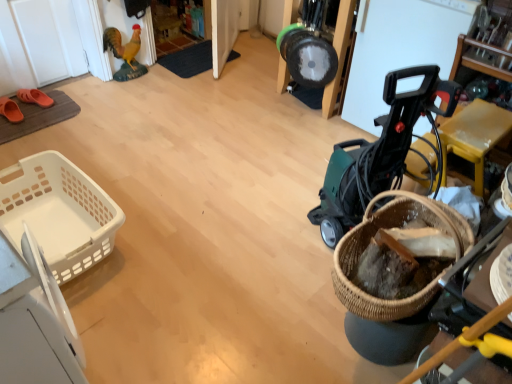
Image resolution: width=512 pixels, height=384 pixels. What are the coordinates of `vacant space to the right of white plastic basket at left, the 1th basket when ordered from back to front` in the screenshot? It's located at (174, 248).